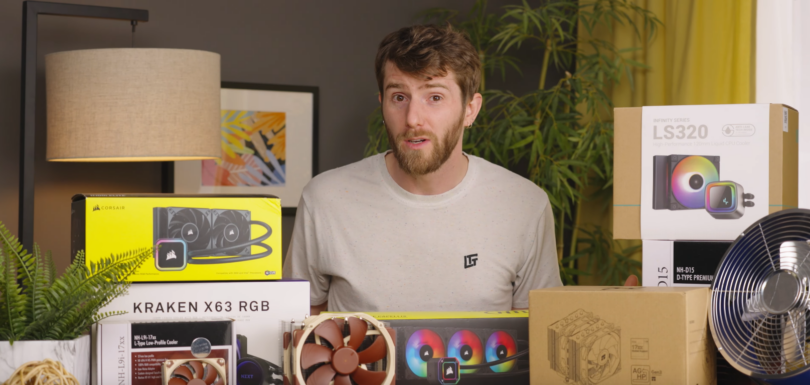
Where is `different audio equipment in front of a man`? The image size is (810, 385). different audio equipment in front of a man is located at coordinates (237, 253), (698, 182), (471, 364), (206, 352).